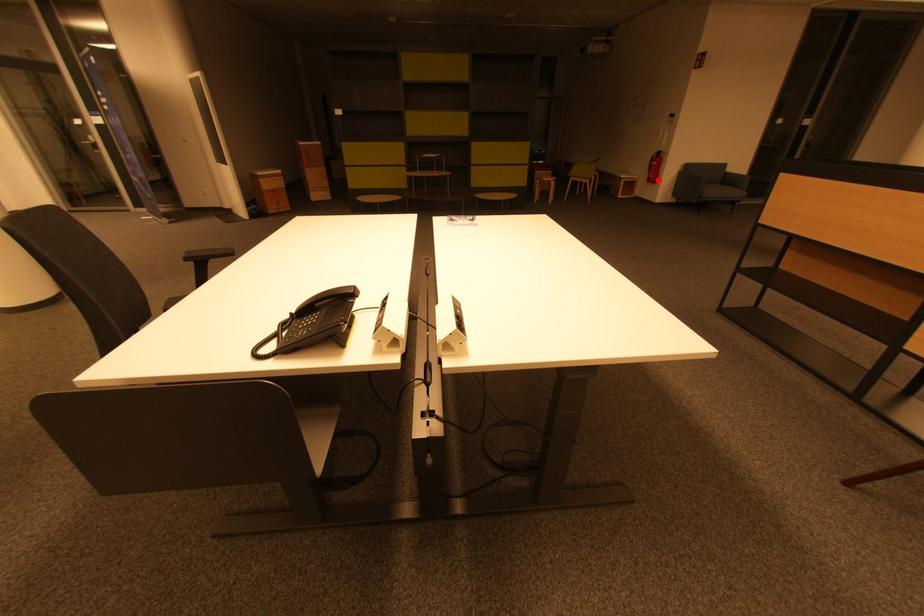
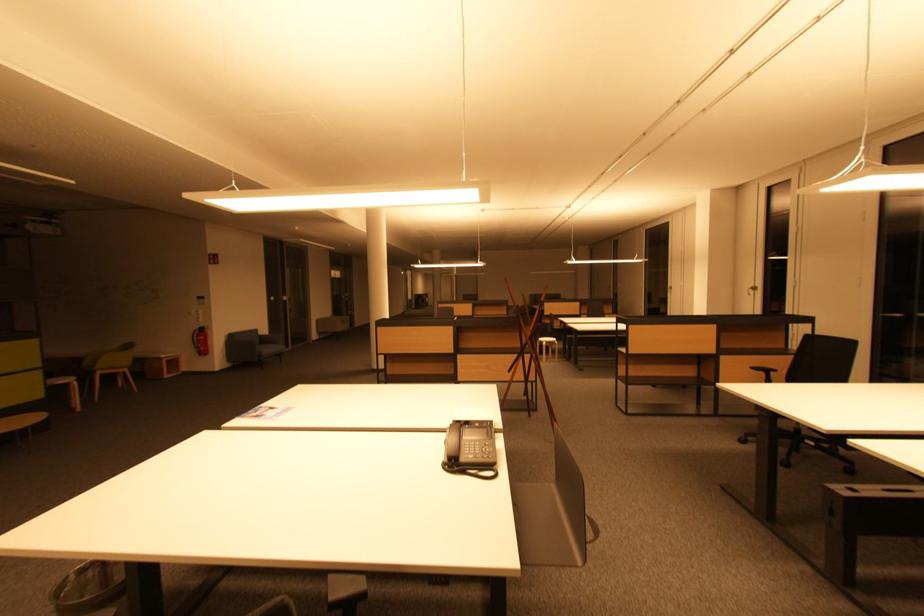
The point at the highlighted location is marked in the first image. Where is the corresponding point in the second image?

(207, 353)